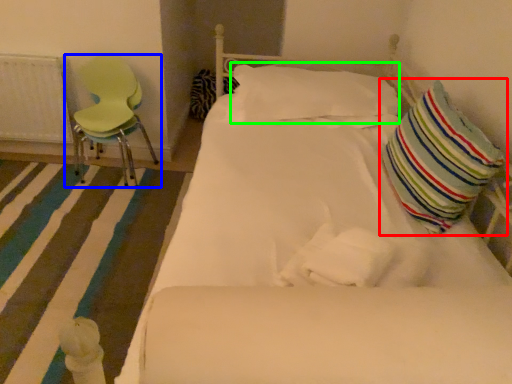
Question: Which object is positioned closest to pillow (highlighted by a red box)? Select from chair (highlighted by a blue box) and pillow (highlighted by a green box).

Choices:
 (A) chair
 (B) pillow

Answer: (B)